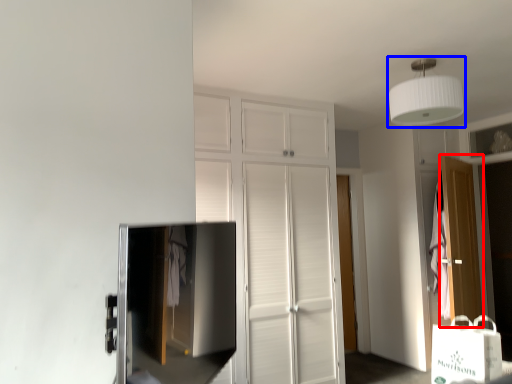
Question: Which of the following is the closest to the observer, door (highlighted by a red box) or lamp (highlighted by a blue box)?

Choices:
 (A) door
 (B) lamp

Answer: (B)